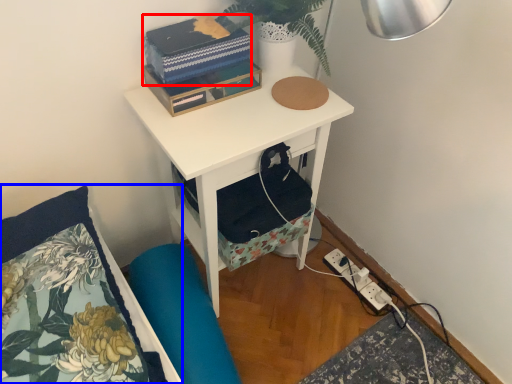
Question: Which object appears farthest to the camera in this image, book (highlighted by a red box) or pillow (highlighted by a blue box)?

Choices:
 (A) book
 (B) pillow

Answer: (A)